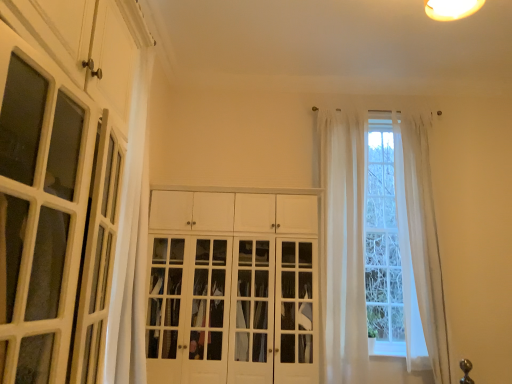
Question: Does sheer white curtain at center, which appears as the second curtain when viewed from the right, have a greater height compared to white glossy cabinet doors at center?

Choices:
 (A) yes
 (B) no

Answer: (A)

Question: Is sheer white curtain at center, arranged as the first curtain when viewed from the left, turned away from white glossy cabinet doors at center?

Choices:
 (A) no
 (B) yes

Answer: (A)

Question: Is sheer white curtain at center, arranged as the first curtain when viewed from the left, oriented towards white glossy cabinet doors at center?

Choices:
 (A) yes
 (B) no

Answer: (B)

Question: Does sheer white curtain at center, which appears as the second curtain when viewed from the right, contain white glossy cabinet doors at center?

Choices:
 (A) yes
 (B) no

Answer: (B)

Question: From the image's perspective, is sheer white curtain at center, arranged as the first curtain when viewed from the left, beneath white glossy cabinet doors at center?

Choices:
 (A) no
 (B) yes

Answer: (A)

Question: From the image's perspective, is sheer white curtain at center, which appears as the second curtain when viewed from the right, above or below white sheer curtain at right, the second curtain in the left-to-right sequence?

Choices:
 (A) below
 (B) above

Answer: (B)

Question: Is sheer white curtain at center, arranged as the first curtain when viewed from the left, in front of or behind white sheer curtain at right, which appears as the 1th curtain when viewed from the right, in the image?

Choices:
 (A) front
 (B) behind

Answer: (A)

Question: Considering the positions of sheer white curtain at center, arranged as the first curtain when viewed from the left, and white sheer curtain at right, which appears as the 1th curtain when viewed from the right, in the image, is sheer white curtain at center, arranged as the first curtain when viewed from the left, wider or thinner than white sheer curtain at right, which appears as the 1th curtain when viewed from the right,?

Choices:
 (A) thin
 (B) wide

Answer: (A)

Question: Would you say sheer white curtain at center, which appears as the second curtain when viewed from the right, is to the left or to the right of white sheer curtain at right, which appears as the 1th curtain when viewed from the right, in the picture?

Choices:
 (A) left
 (B) right

Answer: (A)

Question: Considering the positions of point (114, 79) and point (443, 357), is point (114, 79) closer or farther from the camera than point (443, 357)?

Choices:
 (A) closer
 (B) farther

Answer: (A)

Question: Visually, is white glossy cabinet at left positioned to the left or to the right of white sheer curtain at right, which appears as the 1th curtain when viewed from the right?

Choices:
 (A) right
 (B) left

Answer: (B)

Question: In terms of size, does white glossy cabinet at left appear bigger or smaller than white sheer curtain at right, the second curtain in the left-to-right sequence?

Choices:
 (A) small
 (B) big

Answer: (A)

Question: From a real-world perspective, relative to white sheer curtain at right, which appears as the 1th curtain when viewed from the right, is white glossy cabinet at left vertically above or below?

Choices:
 (A) below
 (B) above

Answer: (B)

Question: Relative to sheer white curtain at center, arranged as the first curtain when viewed from the left, is white glossy cabinet doors at center in front or behind?

Choices:
 (A) front
 (B) behind

Answer: (A)

Question: From a real-world perspective, relative to sheer white curtain at center, arranged as the first curtain when viewed from the left, is white glossy cabinet doors at center vertically above or below?

Choices:
 (A) below
 (B) above

Answer: (A)